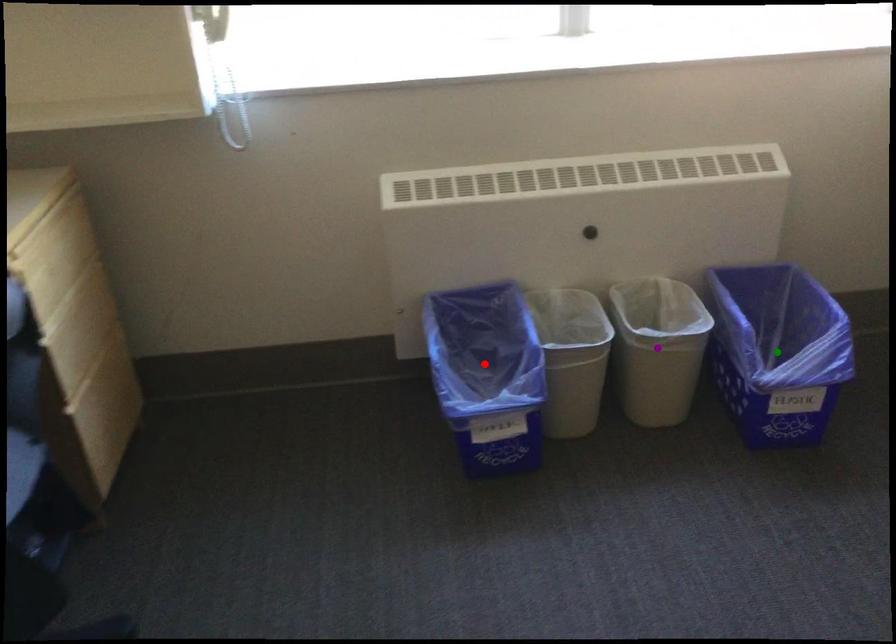
Order these from nearest to farthest:
1. purple point
2. red point
3. green point

red point
purple point
green point